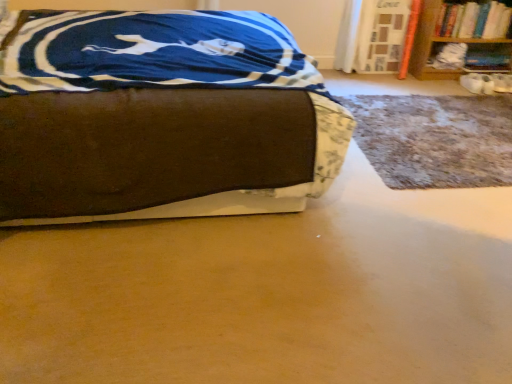
I want to click on hardcover book at upper right, so click(474, 20).

Is hardcover book at upper right positioned with its back to wooden bookshelf at upper right?

Correct, hardcover book at upper right is looking away from wooden bookshelf at upper right.

Can you tell me how much hardcover book at upper right and wooden bookshelf at upper right differ in facing direction?

The angle between the facing direction of hardcover book at upper right and the facing direction of wooden bookshelf at upper right is 2.69 degrees.

Which is closer, (463, 24) or (469, 39)?

The point (463, 24) is more forward.

Visually, is hardcover book at upper right positioned to the left or to the right of wooden bookshelf at upper right?

From the image, it's evident that hardcover book at upper right is to the right of wooden bookshelf at upper right.

Is wooden bookshelf at upper right next to brown fabric bed at center?

No, wooden bookshelf at upper right is not making contact with brown fabric bed at center.

Can we say wooden bookshelf at upper right lies outside brown fabric bed at center?

Yes.

Is wooden bookshelf at upper right closer to camera compared to brown fabric bed at center?

No, wooden bookshelf at upper right is further to the viewer.

Considering the relative positions of wooden bookshelf at upper right and brown fabric bed at center in the image provided, is wooden bookshelf at upper right to the left of brown fabric bed at center from the viewer's perspective?

In fact, wooden bookshelf at upper right is to the right of brown fabric bed at center.

From their relative heights in the image, would you say brown fabric bed at center is taller or shorter than hardcover book at upper right?

brown fabric bed at center is taller than hardcover book at upper right.

Is brown fabric bed at center positioned with its back to hardcover book at upper right?

No, brown fabric bed at center is not facing away from hardcover book at upper right.

Considering the sizes of objects brown fabric bed at center and hardcover book at upper right in the image provided, who is wider, brown fabric bed at center or hardcover book at upper right?

Wider between the two is brown fabric bed at center.

From a real-world perspective, is brown fabric bed at center physically below hardcover book at upper right?

Yes.

Is hardcover book at upper right surrounding brown fabric bed at center?

Definitely not — brown fabric bed at center is not inside hardcover book at upper right.

Are hardcover book at upper right and brown fabric bed at center far apart?

Yes, hardcover book at upper right and brown fabric bed at center are quite far apart.

Between hardcover book at upper right and brown fabric bed at center, which one has less height?

Standing shorter between the two is hardcover book at upper right.

Considering their positions, is hardcover book at upper right located in front of or behind brown fabric bed at center?

In the image, hardcover book at upper right appears behind brown fabric bed at center.

Identify the location of bookcase above the brown fabric bed at center (from the image's perspective). This screenshot has height=384, width=512. (459, 34).

Looking at their sizes, would you say brown fabric bed at center is wider or thinner than wooden bookshelf at upper right?

Considering their sizes, brown fabric bed at center looks broader than wooden bookshelf at upper right.

Is point (166, 46) farther from camera compared to point (475, 13)?

No, (166, 46) is closer to viewer.

Is brown fabric bed at center at the right side of wooden bookshelf at upper right?

Incorrect, brown fabric bed at center is not on the right side of wooden bookshelf at upper right.

This screenshot has width=512, height=384. Identify the location of bookcase on the left of hardcover book at upper right. (459, 34).

Which object is positioned more to the left, wooden bookshelf at upper right or hardcover book at upper right?

From the viewer's perspective, wooden bookshelf at upper right appears more on the left side.

Which of these two, wooden bookshelf at upper right or hardcover book at upper right, stands shorter?

Standing shorter between the two is hardcover book at upper right.

Consider the image. Considering the relative positions of wooden bookshelf at upper right and hardcover book at upper right in the image provided, is wooden bookshelf at upper right behind hardcover book at upper right?

No.

Find the location of `book above the wooden bookshelf at upper right (from a real-world perspective)`. book above the wooden bookshelf at upper right (from a real-world perspective) is located at coordinates (474, 20).

This screenshot has height=384, width=512. Identify the location of bed lying below the wooden bookshelf at upper right (from the image's perspective). tap(161, 118).

From the image, which object appears to be farther from wooden bookshelf at upper right, hardcover book at upper right or brown fabric bed at center?

Based on the image, brown fabric bed at center appears to be further to wooden bookshelf at upper right.

Based on their spatial positions, is brown fabric bed at center or wooden bookshelf at upper right further from hardcover book at upper right?

brown fabric bed at center lies further to hardcover book at upper right than the other object.

From the picture: When comparing their distances from brown fabric bed at center, does hardcover book at upper right or wooden bookshelf at upper right seem closer?

Based on the image, wooden bookshelf at upper right appears to be nearer to brown fabric bed at center.

Considering their positions, is brown fabric bed at center positioned closer to wooden bookshelf at upper right than hardcover book at upper right?

The object closer to wooden bookshelf at upper right is hardcover book at upper right.

Which object lies further to the anchor point hardcover book at upper right, wooden bookshelf at upper right or brown fabric bed at center?

Based on the image, brown fabric bed at center appears to be further to hardcover book at upper right.

When comparing their distances from brown fabric bed at center, does wooden bookshelf at upper right or hardcover book at upper right seem further?

hardcover book at upper right is further to brown fabric bed at center.

Locate an element on the screen. bookcase located between brown fabric bed at center and hardcover book at upper right in the left-right direction is located at coordinates coord(459,34).